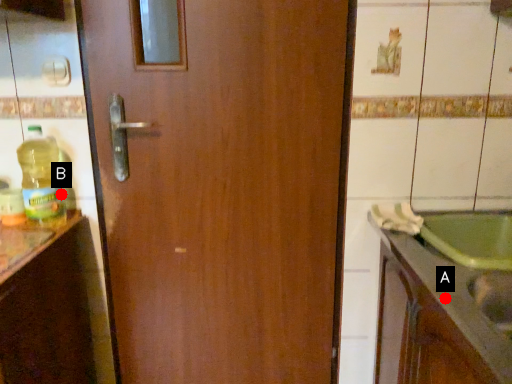
Question: Two points are circled on the image, labeled by A and B beside each circle. Which point appears farthest from the camera in this image?

Choices:
 (A) A is further
 (B) B is further

Answer: (B)